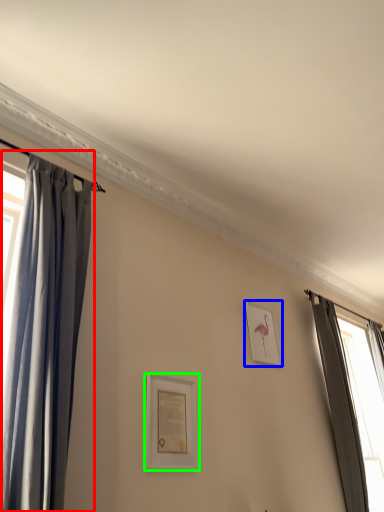
Question: Based on their relative distances, which object is nearer to curtain (highlighted by a red box)? Choose from picture frame (highlighted by a blue box) and picture frame (highlighted by a green box).

Choices:
 (A) picture frame
 (B) picture frame

Answer: (B)